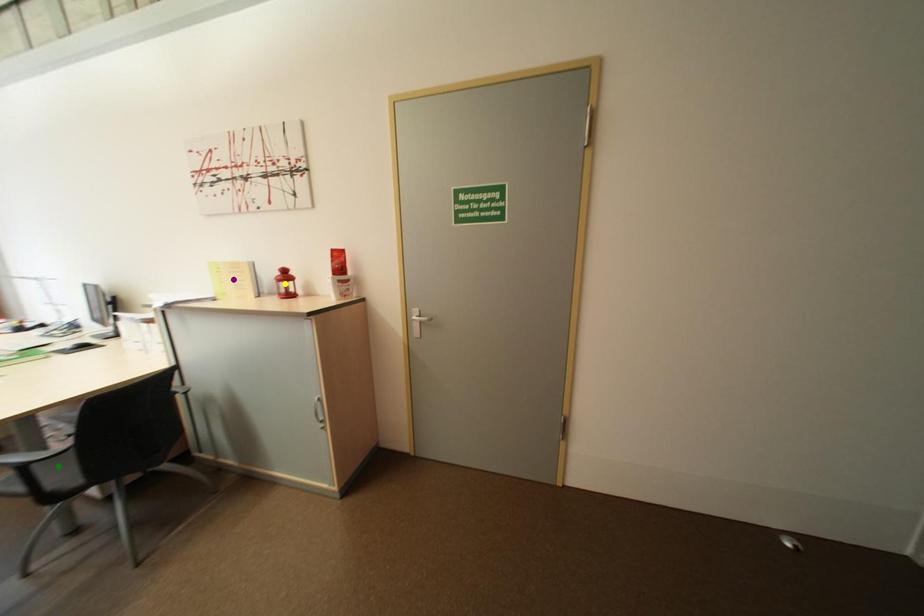
Order these from farthest to nearest:
green point
yellow point
purple point

yellow point < purple point < green point